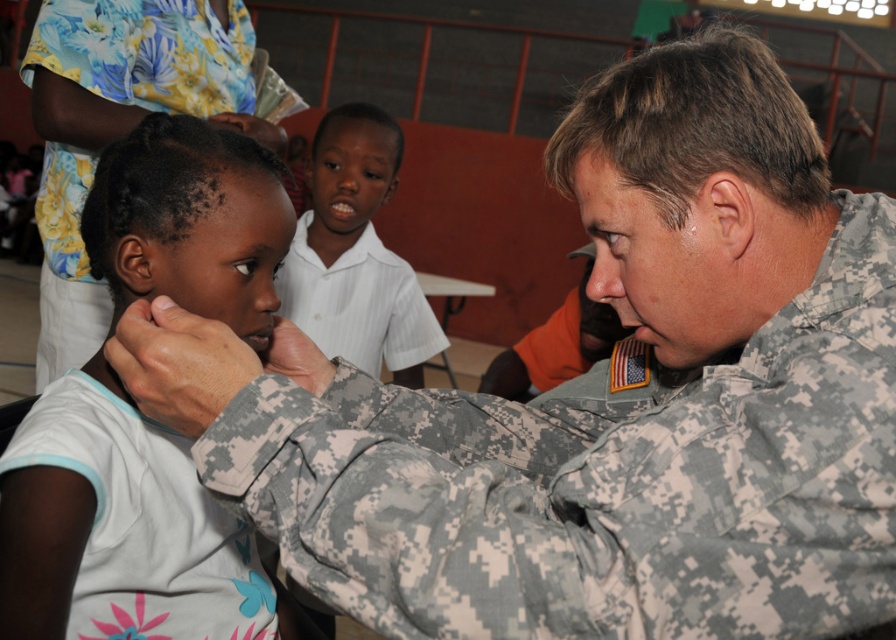
Between camouflage fabric at center and white striped shirt at center, which one is positioned higher?

white striped shirt at center

Which is behind, point (225, 564) or point (322, 186)?

The point (322, 186) is more distant.

Who is more distant from viewer, [220,612] or [362,147]?

The point [362,147] is more distant.

Locate an element on the screen. camouflage fabric at center is located at coordinates (144, 524).

Is white matte shirt at center smaller than white striped shirt at center?

Yes, white matte shirt at center is smaller than white striped shirt at center.

Can you confirm if white matte shirt at center is positioned to the right of white striped shirt at center?

Correct, you'll find white matte shirt at center to the right of white striped shirt at center.

The width and height of the screenshot is (896, 640). I want to click on white matte shirt at center, so click(190, 221).

In order to click on white matte shirt at center in this screenshot , I will do `click(190, 221)`.

Does white matte shirt at center have a larger size compared to camouflage fabric at center?

Yes.

Measure the distance between point [179,196] and camera.

Point [179,196] is 1.02 meters away from camera.

Image resolution: width=896 pixels, height=640 pixels. I want to click on white matte shirt at center, so click(190, 221).